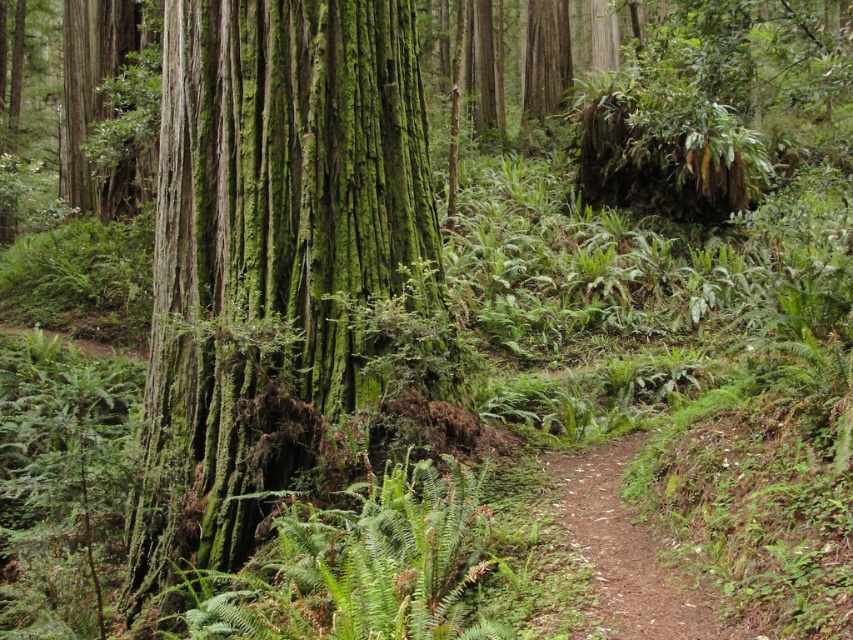
Consider the image. You are a hiker who wants to take a photo of the brown dirt path at center without the green mossy bark tree at center blocking the view. Which direction should you move to ensure the tree is out of frame?

The green mossy bark tree at center is closer to you than the brown dirt path at center. To avoid the tree blocking the view of the brown dirt path at center, you should move backward to create distance between yourself and the tree so that it no longer obstructs the path.

You are standing in a forest and see a point marked at coordinates [280,262]. Based on the scene description, what object is located at that point?

The point at coordinates [280,262] indicates the location of the green mossy bark tree at center.

You are a hiker trying to navigate through the forest. You see the green mossy bark tree at center and the brown dirt path at center. Which one is wider?

The green mossy bark tree at center is wider than the brown dirt path at center.